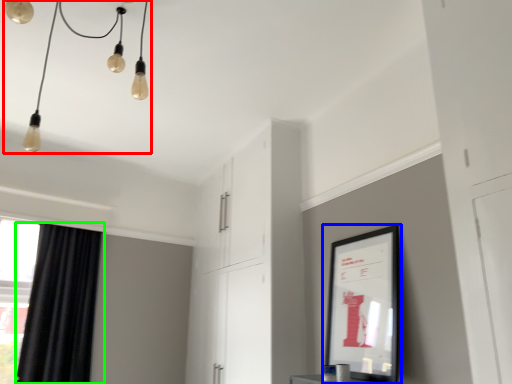
Question: Which is nearer to the light fixture (highlighted by a red box)? picture frame (highlighted by a blue box) or curtain (highlighted by a green box).

Choices:
 (A) picture frame
 (B) curtain

Answer: (B)